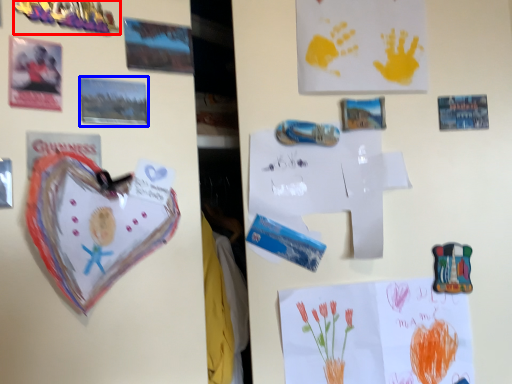
Question: Which point is closer to the camera, toy (highlighted by a red box) or postcard (highlighted by a blue box)?

Choices:
 (A) toy
 (B) postcard

Answer: (A)